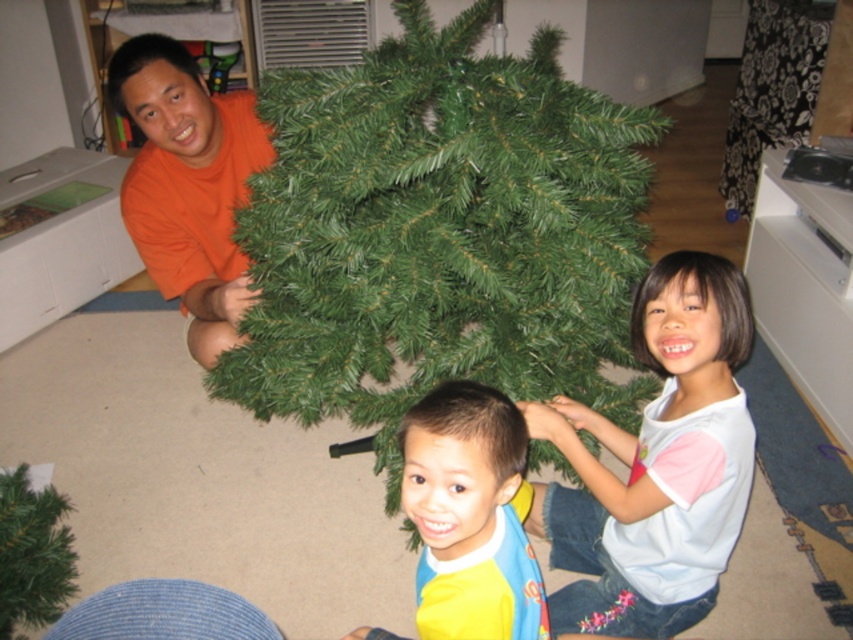
Question: Is white cotton shirt at center further to the viewer compared to yellow fabric bib at center?

Choices:
 (A) yes
 (B) no

Answer: (A)

Question: Estimate the real-world distances between objects in this image. Which object is closer to the yellow fabric bib at center?

Choices:
 (A) green artificial christmas tree at center
 (B) white cotton shirt at center

Answer: (B)

Question: Which of the following is the farthest from the observer?

Choices:
 (A) (518, 419)
 (B) (189, 160)
 (C) (625, 163)
 (D) (726, 333)

Answer: (B)

Question: Is green artificial christmas tree at center smaller than yellow fabric bib at center?

Choices:
 (A) yes
 (B) no

Answer: (B)

Question: Which object appears closest to the camera in this image?

Choices:
 (A) yellow fabric bib at center
 (B) orange matte shirt at left
 (C) green artificial christmas tree at center
 (D) white cotton shirt at center

Answer: (A)

Question: Where is green artificial christmas tree at center located in relation to yellow fabric bib at center in the image?

Choices:
 (A) above
 (B) below

Answer: (A)